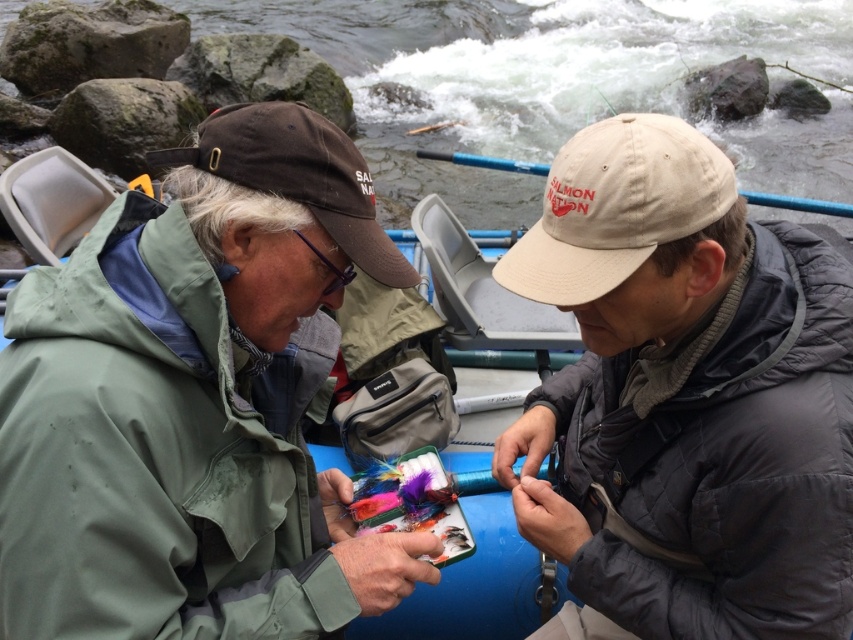
Who is lower down, white frothy water at upper center or brown fabric baseball cap at upper left?

brown fabric baseball cap at upper left is below.

Does white frothy water at upper center have a greater height compared to brown fabric baseball cap at upper left?

Correct, white frothy water at upper center is much taller as brown fabric baseball cap at upper left.

In order to click on white frothy water at upper center in this screenshot , I will do `click(521, 74)`.

Who is taller, beige cotton cap at upper center or brown fabric baseball cap at upper left?

beige cotton cap at upper center is taller.

You are a GUI agent. You are given a task and a screenshot of the screen. Output one action in this format:
    pyautogui.click(x=<x>, y=<y>)
    Task: Click on the beige cotton cap at upper center
    The height and width of the screenshot is (640, 853).
    Given the screenshot: What is the action you would take?
    pyautogui.click(x=616, y=205)

At what (x,y) coordinates should I click in order to perform the action: click on beige cotton cap at upper center. Please return your answer as a coordinate pair (x, y). Looking at the image, I should click on (616, 205).

Locate an element on the screen. beige fabric cap at center is located at coordinates (685, 397).

Which is in front, point (770, 404) or point (554, 122)?

Point (770, 404) is in front.

Measure the distance between beige fabric cap at center and camera.

beige fabric cap at center and camera are 3.75 feet apart.

Where is `beige fabric cap at center`? The height and width of the screenshot is (640, 853). beige fabric cap at center is located at coordinates (685, 397).